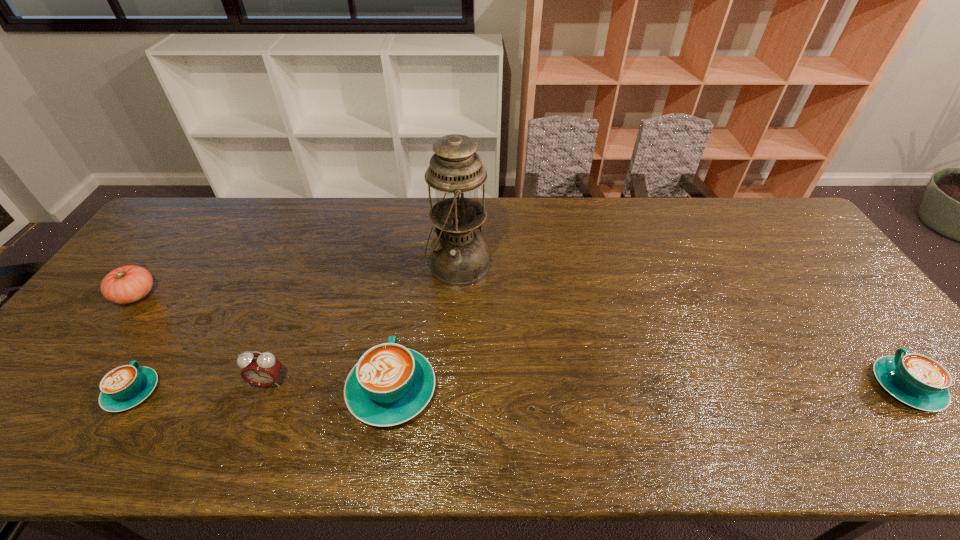
At what (x,y) coordinates should I click in order to perform the action: click on the shortest object. Please return your answer as a coordinate pair (x, y). The image size is (960, 540). Looking at the image, I should click on (124, 387).

Locate an element on the screen. the shortest cappuccino is located at coordinates (124, 387).

At what (x,y) coordinates should I click in order to perform the action: click on the second cappuccino from left to right. Please return your answer as a coordinate pair (x, y). Looking at the image, I should click on (390, 384).

Where is `tomato`? The image size is (960, 540). tomato is located at coordinates click(127, 284).

You are a GUI agent. You are given a task and a screenshot of the screen. Output one action in this format:
    pyautogui.click(x=<x>, y=<y>)
    Task: Click on the oil lamp
    The image size is (960, 540).
    Given the screenshot: What is the action you would take?
    pyautogui.click(x=459, y=256)

The height and width of the screenshot is (540, 960). In order to click on the fourth object from right to left in this screenshot , I will do `click(261, 369)`.

Find the location of a particular element. This screenshot has height=540, width=960. alarm clock is located at coordinates (261, 369).

Identify the location of blank area located 0.390m with the handle on the right side of the fifth object from right to left. (213, 262).

Where is `vacant area located 0.090m with the handle on the right side of the fifth object from right to left`? vacant area located 0.090m with the handle on the right side of the fifth object from right to left is located at coordinates (164, 340).

Image resolution: width=960 pixels, height=540 pixels. What are the coordinates of `free space located with the handle on the right side of the fifth object from right to left` in the screenshot? It's located at (215, 260).